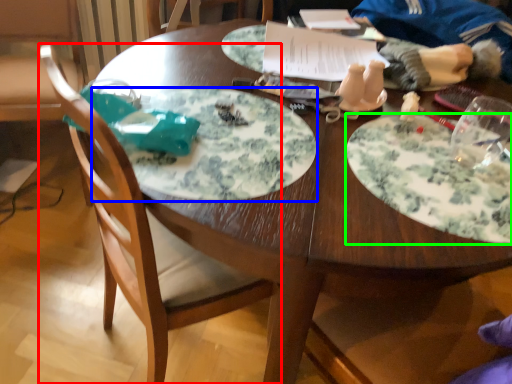
Question: Considering the real-world distances, which object is closest to chair (highlighted by a red box)? plate (highlighted by a blue box) or plate (highlighted by a green box).

Choices:
 (A) plate
 (B) plate

Answer: (A)